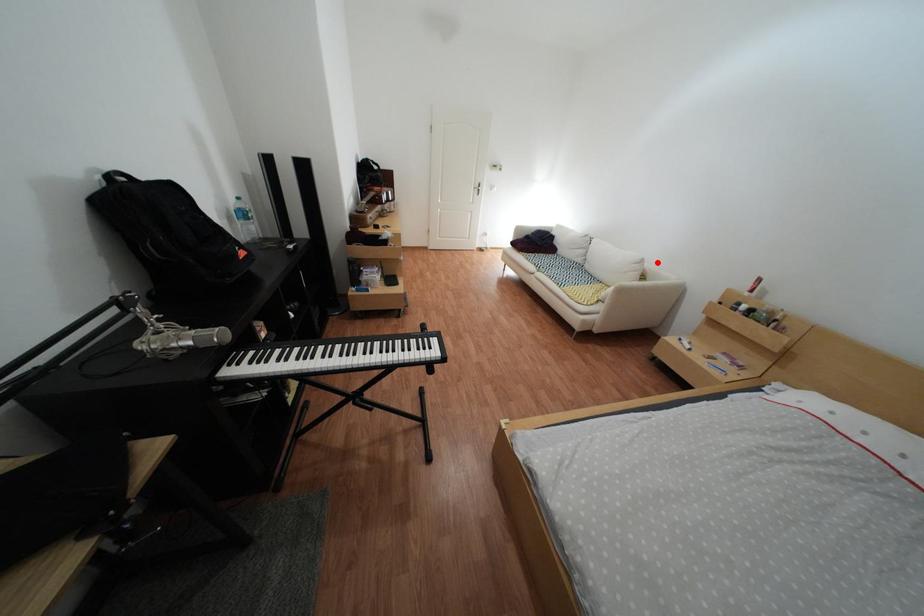
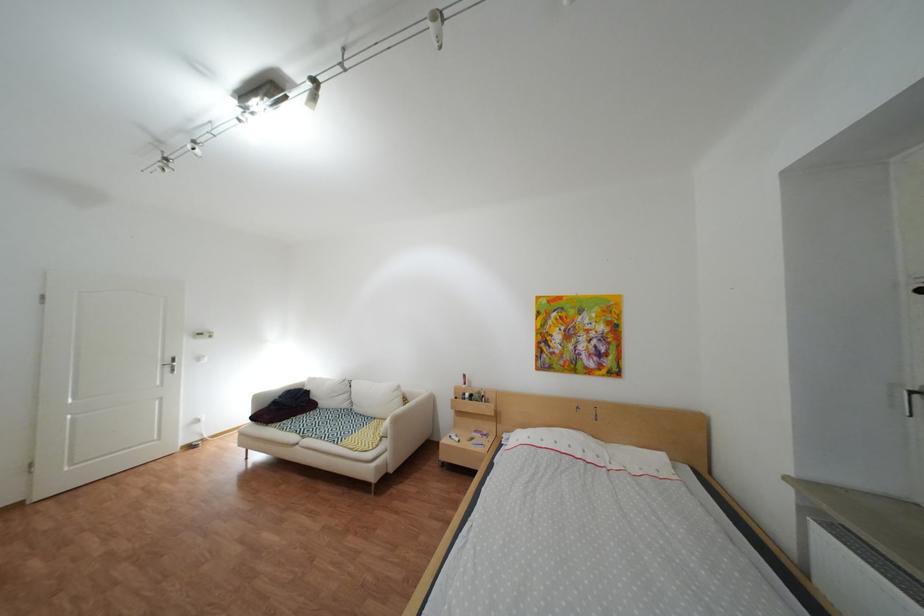
In the second image, find the point that corresponds to the highlighted location in the first image.

(415, 389)